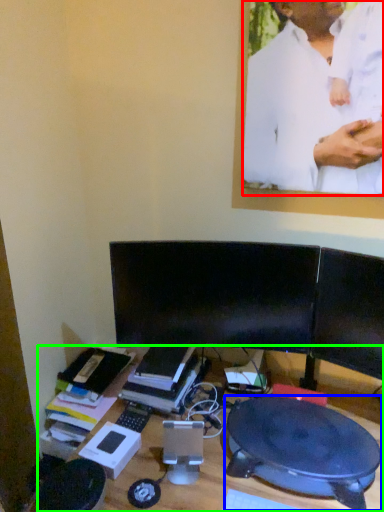
Question: Based on their relative distances, which object is farther from man (highlighted by a red box)? Choose from round table (highlighted by a blue box) and desk (highlighted by a green box).

Choices:
 (A) round table
 (B) desk

Answer: (B)